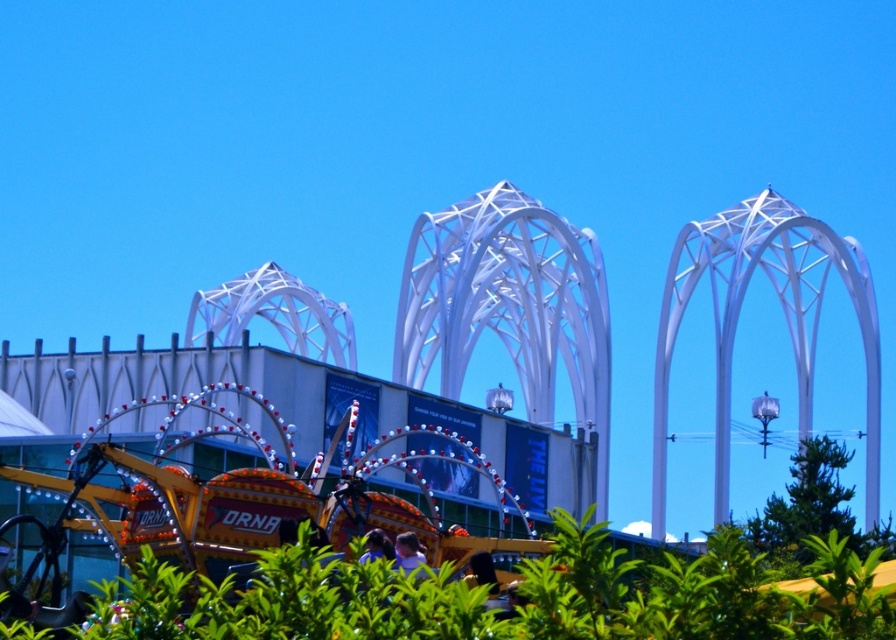
Question: Does metallic amusement ride at center have a larger size compared to metallic yellow amusement ride at lower left?

Choices:
 (A) no
 (B) yes

Answer: (B)

Question: Is metallic amusement ride at center bigger than metallic yellow amusement ride at lower left?

Choices:
 (A) no
 (B) yes

Answer: (B)

Question: Does metallic amusement ride at center appear on the right side of metallic yellow amusement ride at lower left?

Choices:
 (A) yes
 (B) no

Answer: (A)

Question: Which point is farther from the camera taking this photo?

Choices:
 (A) pyautogui.click(x=421, y=492)
 (B) pyautogui.click(x=501, y=481)

Answer: (A)

Question: Which of the following is the closest to the observer?

Choices:
 (A) (314, 500)
 (B) (695, 573)

Answer: (B)